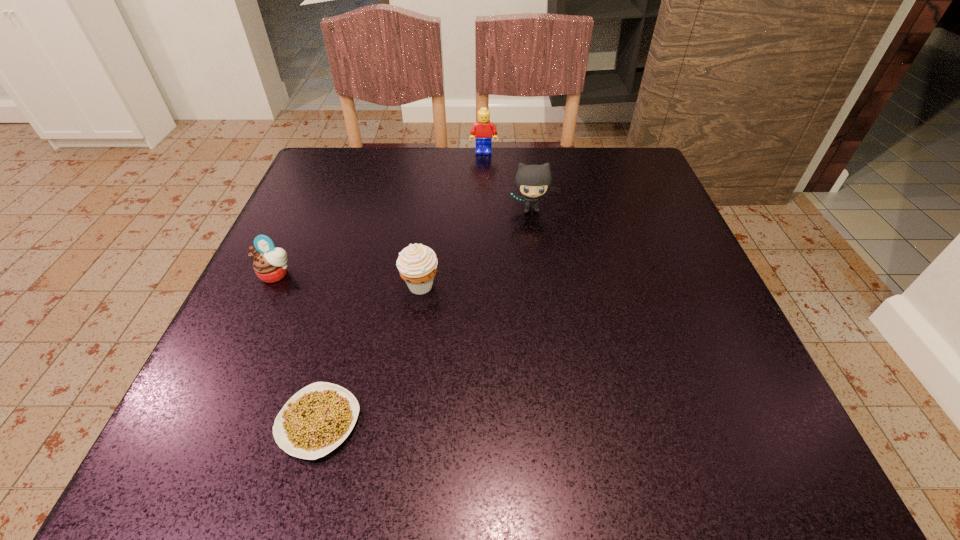
You are a GUI agent. You are given a task and a screenshot of the screen. Output one action in this format:
    pyautogui.click(x=<x>, y=<y>)
    Task: Click on the vacant space situated 0.230m on the front-facing side of the Lego
    Image resolution: width=960 pixels, height=540 pixels.
    Given the screenshot: What is the action you would take?
    pyautogui.click(x=485, y=210)

The image size is (960, 540). Identify the location of vacant space located on the front-facing side of the kitten. (538, 259).

Locate an element on the screen. free space located 0.240m on the front of the right muffin is located at coordinates (400, 432).

The image size is (960, 540). Identify the location of free space located on the front-facing side of the fourth tallest object. (252, 324).

Where is `free region located on the right of the shortest object`? free region located on the right of the shortest object is located at coordinates (534, 422).

The image size is (960, 540). I want to click on Lego that is positioned at the far edge, so click(x=483, y=129).

The image size is (960, 540). In order to click on kitten situated at the far edge in this screenshot , I will do `click(532, 181)`.

Where is `object present at the near edge`? The image size is (960, 540). object present at the near edge is located at coordinates (317, 419).

The image size is (960, 540). Find the location of `muffin at the left edge`. muffin at the left edge is located at coordinates (269, 264).

The image size is (960, 540). Find the location of `legume located in the left edge section of the desktop`. legume located in the left edge section of the desktop is located at coordinates (317, 419).